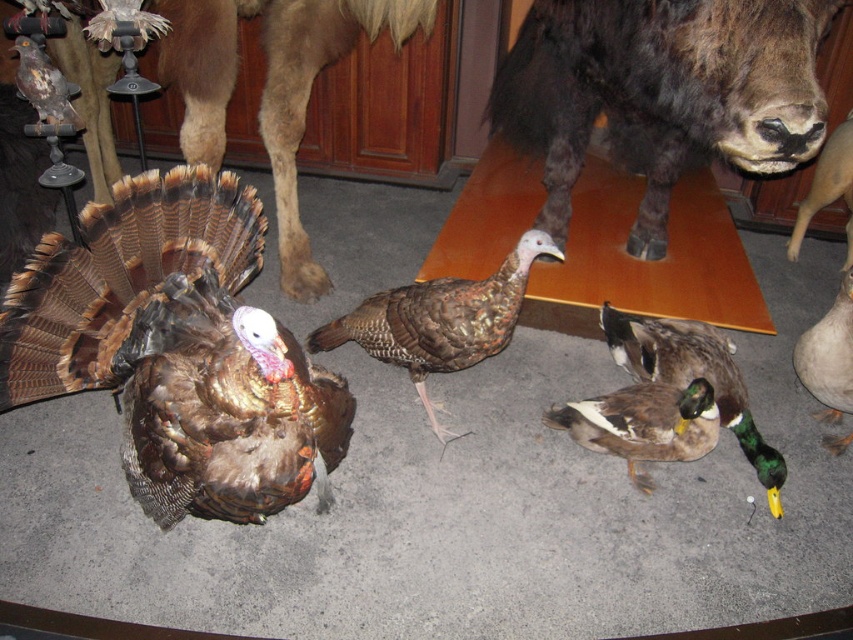
Can you confirm if shiny brown turkey at center is positioned to the right of brown matte turkey at center?

No, shiny brown turkey at center is not to the right of brown matte turkey at center.

Who is positioned more to the left, shiny brown turkey at center or brown matte turkey at center?

shiny brown turkey at center

Which is in front, point (86, 216) or point (463, 321)?

Positioned in front is point (86, 216).

At what (x,y) coordinates should I click in order to perform the action: click on shiny brown turkey at center. Please return your answer as a coordinate pair (x, y). Looking at the image, I should click on coord(171,342).

Does shiny brown turkey at center have a larger size compared to shiny brown turkey at upper left?

Yes.

Which is behind, point (24, 310) or point (45, 56)?

Point (45, 56)

At what (x,y) coordinates should I click in order to perform the action: click on shiny brown turkey at center. Please return your answer as a coordinate pair (x, y). The image size is (853, 640). Looking at the image, I should click on (171, 342).

Does green glossy duck at lower right lie in front of shiny brown turkey at upper left?

Yes, green glossy duck at lower right is in front of shiny brown turkey at upper left.

Who is positioned more to the left, green glossy duck at lower right or shiny brown turkey at upper left?

From the viewer's perspective, shiny brown turkey at upper left appears more on the left side.

Which is behind, point (722, 381) or point (61, 83)?

The point (61, 83) is behind.

The image size is (853, 640). Find the location of `green glossy duck at lower right`. green glossy duck at lower right is located at coordinates pos(694,378).